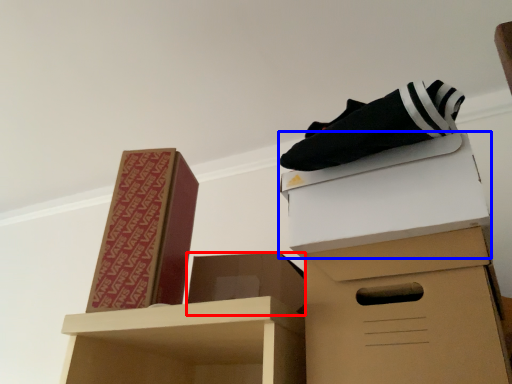
Question: Which object is further to the camera taking this photo, box (highlighted by a red box) or box (highlighted by a blue box)?

Choices:
 (A) box
 (B) box

Answer: (A)